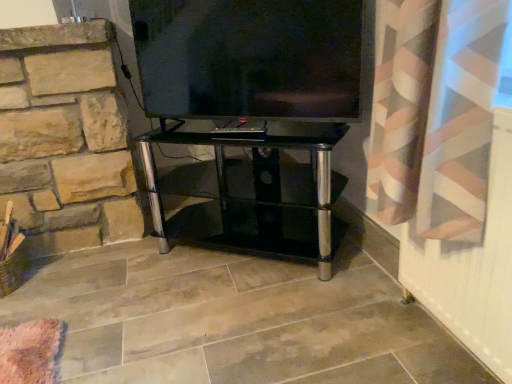
Locate an element on the screen. flat screen tv at center is located at coordinates (250, 58).

What is the approximate width of flat screen tv at center?

3.96 inches.

What do you see at coordinates (250, 58) in the screenshot? I see `flat screen tv at center` at bounding box center [250, 58].

Where is `black glass tv stand at center`? black glass tv stand at center is located at coordinates (259, 196).

Image resolution: width=512 pixels, height=384 pixels. Describe the element at coordinates (259, 196) in the screenshot. I see `black glass tv stand at center` at that location.

At what (x,y) coordinates should I click in order to perform the action: click on flat screen tv at center. Please return your answer as a coordinate pair (x, y). Image resolution: width=512 pixels, height=384 pixels. Looking at the image, I should click on [x=250, y=58].

Is black glass tv stand at center to the right of flat screen tv at center from the viewer's perspective?

In fact, black glass tv stand at center is to the left of flat screen tv at center.

Which object is closer to the camera taking this photo, black glass tv stand at center or flat screen tv at center?

flat screen tv at center is more forward.

Which is in front, point (214, 143) or point (312, 63)?

Point (312, 63)

From the image's perspective, who appears lower, black glass tv stand at center or flat screen tv at center?

black glass tv stand at center, from the image's perspective.

From a real-world perspective, between black glass tv stand at center and flat screen tv at center, who is vertically lower?

From a 3D spatial view, black glass tv stand at center is below.

Is black glass tv stand at center wider than flat screen tv at center?

Yes, black glass tv stand at center is wider than flat screen tv at center.

From the picture: Is black glass tv stand at center taller than flat screen tv at center?

Indeed, black glass tv stand at center has a greater height compared to flat screen tv at center.

Considering the sizes of black glass tv stand at center and flat screen tv at center in the image, is black glass tv stand at center bigger or smaller than flat screen tv at center?

In the image, black glass tv stand at center appears to be larger than flat screen tv at center.

Would you say black glass tv stand at center contains flat screen tv at center?

No, black glass tv stand at center does not contain flat screen tv at center.

Is black glass tv stand at center in contact with flat screen tv at center?

black glass tv stand at center and flat screen tv at center are not in contact.

Is flat screen tv at center at the back of black glass tv stand at center?

No, flat screen tv at center is not at the back of black glass tv stand at center.

How different are the orientations of black glass tv stand at center and flat screen tv at center in degrees?

1.63 degrees.

I want to click on furniture that appears below the flat screen tv at center (from a real-world perspective), so click(x=259, y=196).

In the scene shown: Is flat screen tv at center to the left or to the right of black glass tv stand at center in the image?

Based on their positions, flat screen tv at center is located to the right of black glass tv stand at center.

Considering the positions of objects flat screen tv at center and black glass tv stand at center in the image provided, who is in front, flat screen tv at center or black glass tv stand at center?

flat screen tv at center is in front.

Is point (311, 72) behind point (200, 136)?

No, it is not.

From the image's perspective, is flat screen tv at center above or below black glass tv stand at center?

From the image's perspective, flat screen tv at center appears above black glass tv stand at center.

From a real-world perspective, which object stands above the other?

flat screen tv at center is physically above.

In terms of width, does flat screen tv at center look wider or thinner when compared to black glass tv stand at center?

flat screen tv at center is thinner than black glass tv stand at center.

In terms of height, does flat screen tv at center look taller or shorter compared to black glass tv stand at center?

Considering their sizes, flat screen tv at center has less height than black glass tv stand at center.

Is flat screen tv at center smaller than black glass tv stand at center?

Correct, flat screen tv at center occupies less space than black glass tv stand at center.

Could black glass tv stand at center be considered to be inside flat screen tv at center?

Actually, black glass tv stand at center is outside flat screen tv at center.

Is flat screen tv at center with black glass tv stand at center?

No, flat screen tv at center is not with black glass tv stand at center.

Is flat screen tv at center positioned with its back to black glass tv stand at center?

That's not correct — flat screen tv at center is not looking away from black glass tv stand at center.

How many degrees apart are the facing directions of flat screen tv at center and black glass tv stand at center?

1.63 degrees.

Measure the distance from flat screen tv at center to black glass tv stand at center.

12.67 inches.

Identify the location of furniture below the flat screen tv at center (from the image's perspective). (259, 196).

I want to click on television that appears on the right of black glass tv stand at center, so click(x=250, y=58).

Locate an element on the screen. Image resolution: width=512 pixels, height=384 pixels. television located above the black glass tv stand at center (from the image's perspective) is located at coordinates (250, 58).